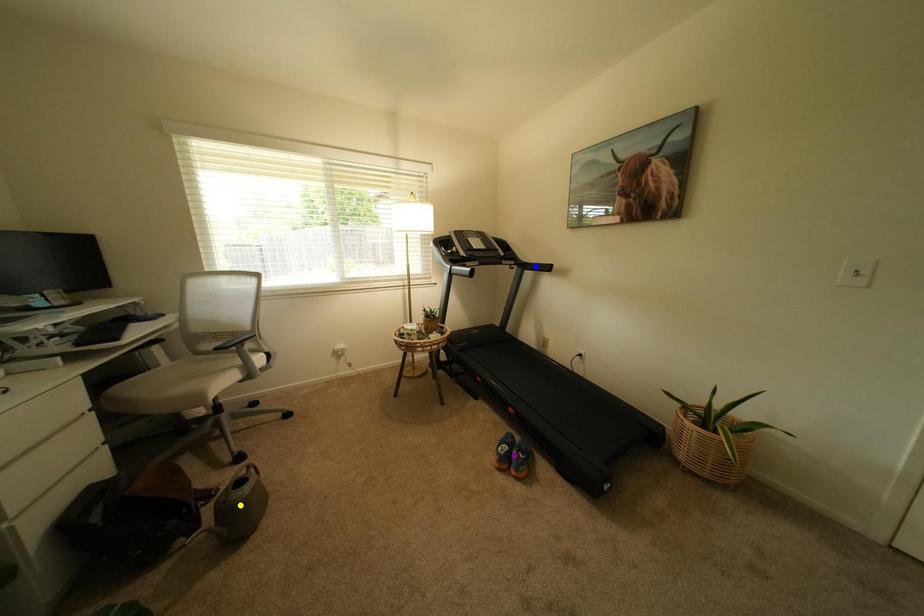
Order these from farthest to nearest:
- blue point
- yellow point
- purple point

1. blue point
2. purple point
3. yellow point